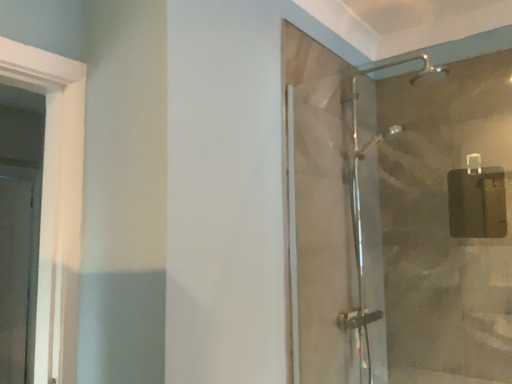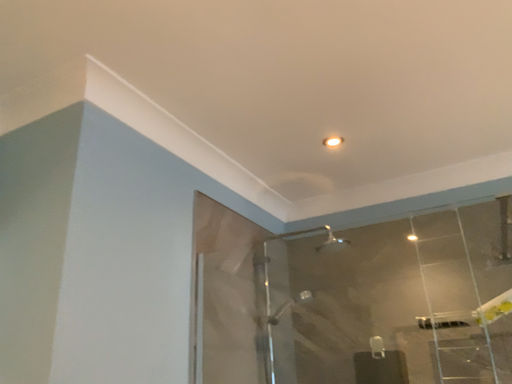
Question: How did the camera likely rotate when shooting the video?

Choices:
 (A) rotated downward
 (B) rotated upward

Answer: (B)